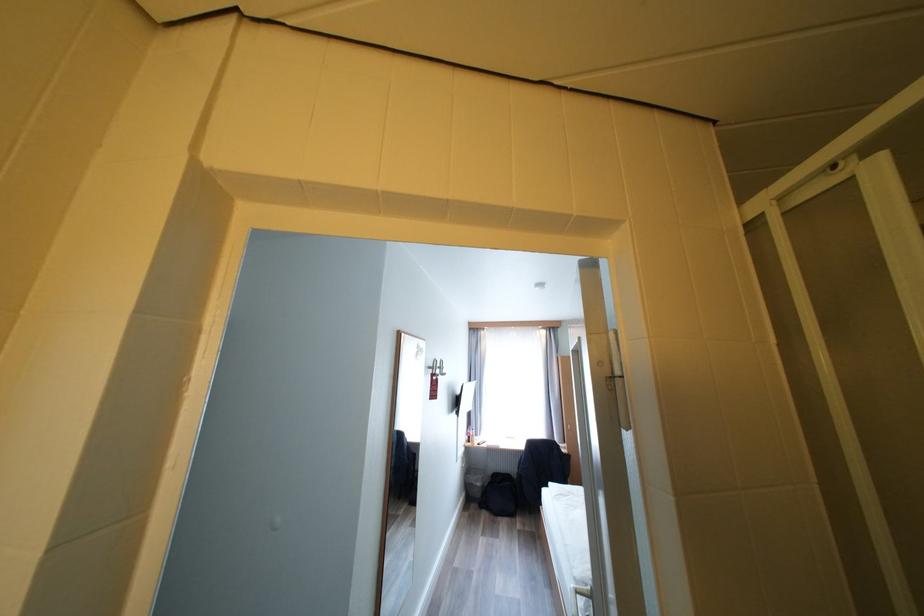
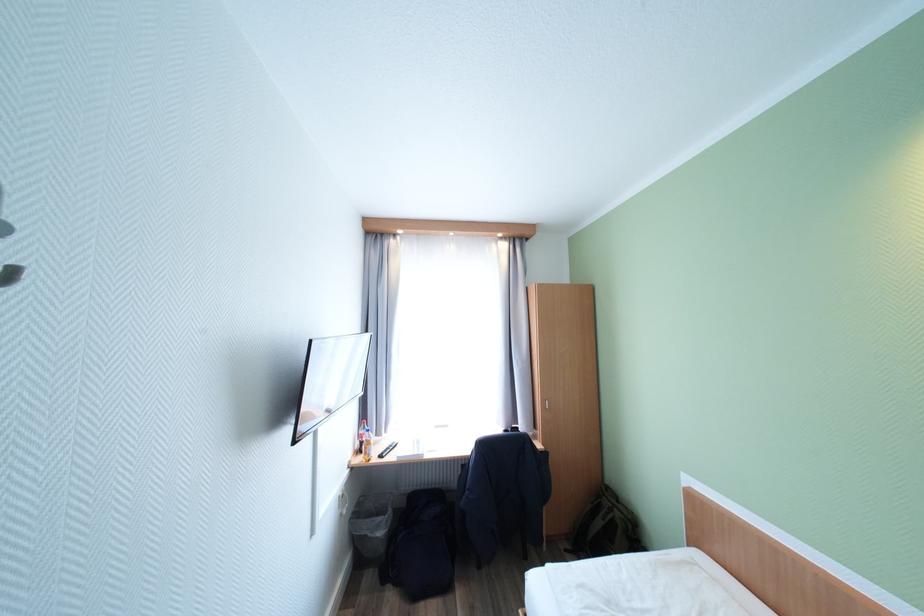
Locate, in the second image, the point that corresponds to [487,496] in the first image.

(390, 551)